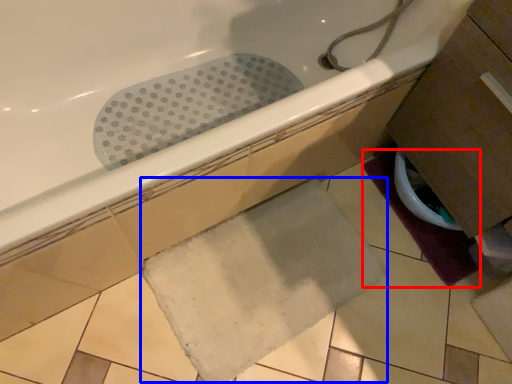
Question: Among these objects, which one is farthest to the camera, bath mat (highlighted by a red box) or bath mat (highlighted by a blue box)?

Choices:
 (A) bath mat
 (B) bath mat

Answer: (A)